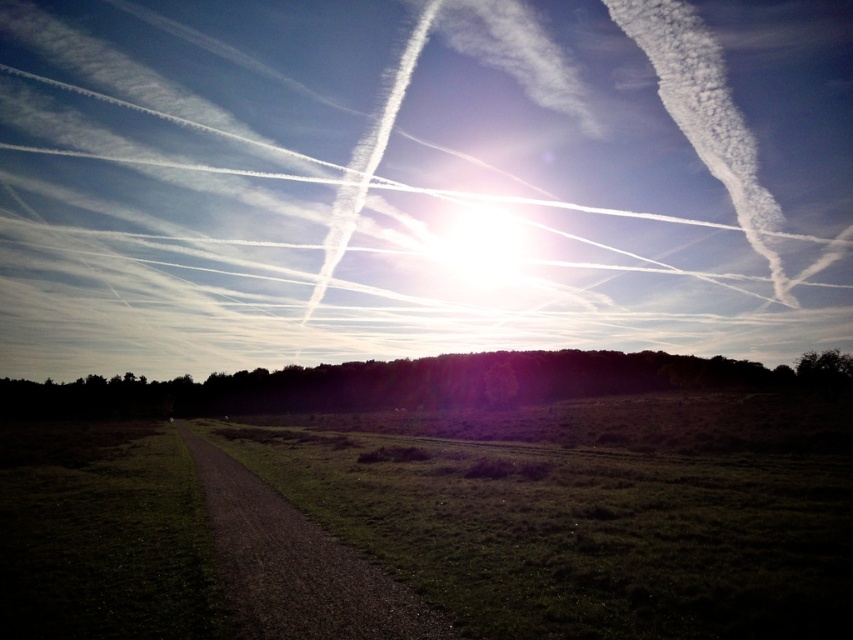
You are standing at the origin point in the scene. Which direction should you walk to reach the green grassy field at lower center?

The green grassy field at lower center is located at point 0.831 in the x direction and 0.681 in the y direction. Since you are at the origin, you should move towards the lower center direction, which corresponds to increasing both x and y coordinates slightly, but primarily moving downward and to the right to reach it.